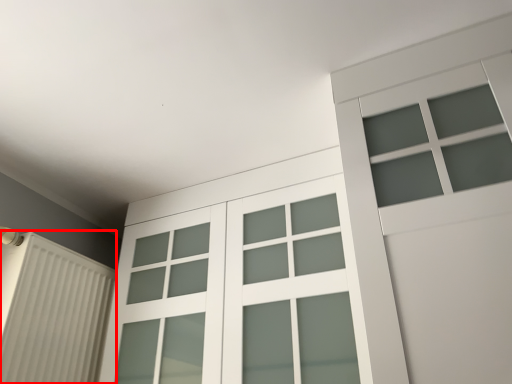
Question: From the image's perspective, where is shutter (annotated by the red box) located in relation to glass door in the image?

Choices:
 (A) below
 (B) above

Answer: (A)